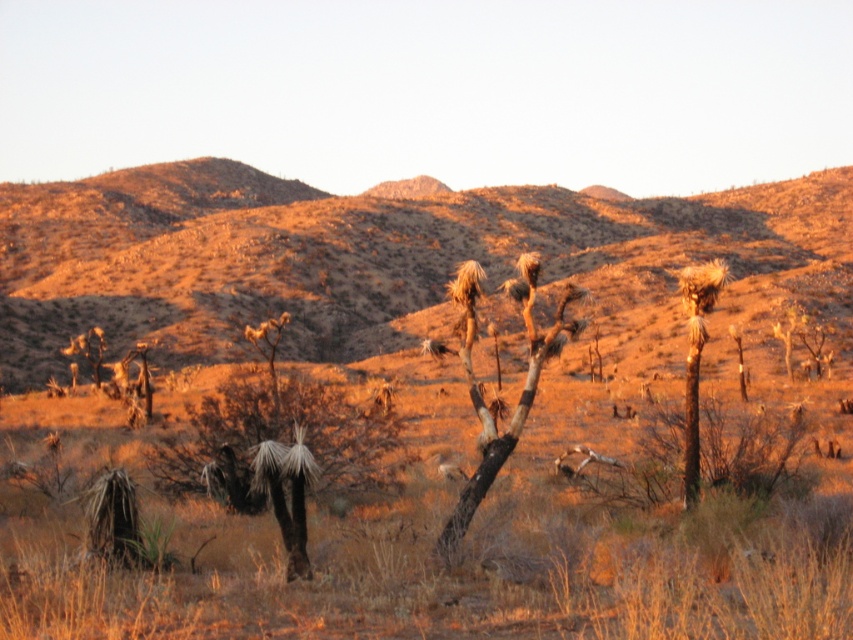
Which is more to the right, dried grass at center or brown woody at right?

brown woody at right is more to the right.

Does dried grass at center have a greater height compared to brown woody at right?

Correct, dried grass at center is much taller as brown woody at right.

Where is `dried grass at center`? Image resolution: width=853 pixels, height=640 pixels. dried grass at center is located at coordinates (328, 252).

Can you confirm if brown woody tree at center is wider than brown rough bark tree at center?

Correct, the width of brown woody tree at center exceeds that of brown rough bark tree at center.

Is point (190, 468) farther from viewer compared to point (465, 513)?

Yes, point (190, 468) is farther from viewer.

Identify the location of brown woody tree at center. (274, 445).

Does brown rough bark tree at center appear on the left side of brown woody at right?

Indeed, brown rough bark tree at center is positioned on the left side of brown woody at right.

Is point (473, 513) more distant than point (686, 276)?

No, it is not.

Between point (560, 344) and point (689, 476), which one is positioned in front?

Point (560, 344)

You are a GUI agent. You are given a task and a screenshot of the screen. Output one action in this format:
    pyautogui.click(x=<x>, y=<y>)
    Task: Click on the brown rough bark tree at center
    This screenshot has height=640, width=853.
    Given the screenshot: What is the action you would take?
    pyautogui.click(x=477, y=381)